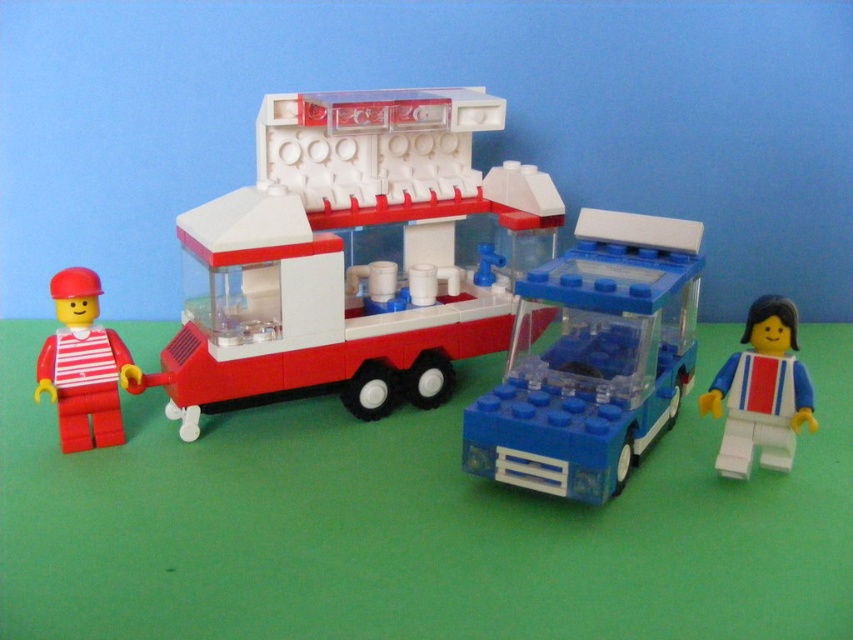
Does point (732, 417) come behind point (39, 358)?

Yes, it is.

Who is positioned more to the left, white plastic figure at right or matte red minifigure at left?

matte red minifigure at left is more to the left.

Is point (732, 380) closer to viewer compared to point (56, 314)?

No, (732, 380) is behind (56, 314).

Find the location of `white plastic figure at right`. white plastic figure at right is located at coordinates (761, 392).

Does point (520, 460) come closer to viewer compared to point (799, 381)?

Yes, point (520, 460) is in front of point (799, 381).

Does point (669, 246) lie behind point (805, 396)?

Yes, it is.

The height and width of the screenshot is (640, 853). I want to click on transparent plastic bus at center, so click(592, 358).

Between transparent plastic bus at center and matte red minifigure at left, which one is positioned higher?

transparent plastic bus at center is higher up.

Which of these two, transparent plastic bus at center or matte red minifigure at left, stands shorter?

matte red minifigure at left is shorter.

This screenshot has height=640, width=853. Find the location of `transparent plastic bus at center`. transparent plastic bus at center is located at coordinates (592, 358).

Identify the location of transparent plastic bus at center. (592, 358).